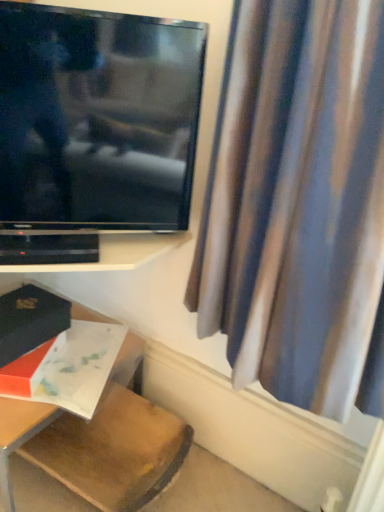
Locate an element on the screen. This screenshot has height=512, width=384. blank space situated above matte white book at lower left, which is counted as the 2th book, starting from the top (from a real-world perspective) is located at coordinates (71, 358).